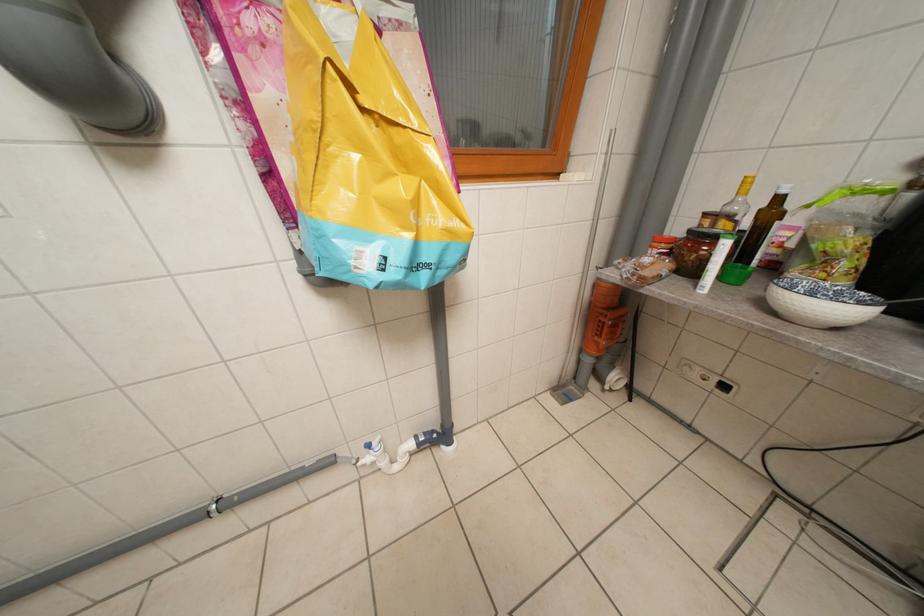
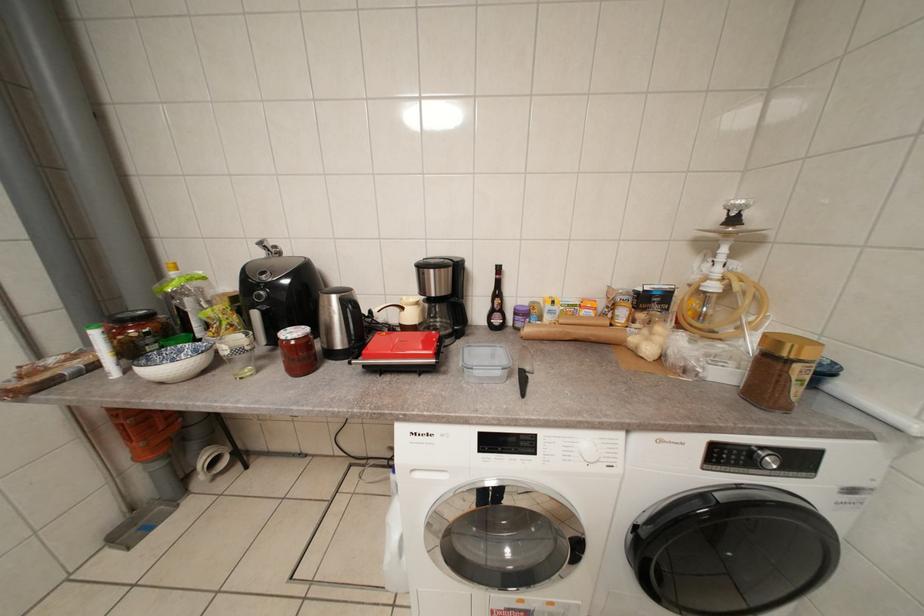
Question: Based on the continuous images, in which direction is the camera rotating? Reply with the corresponding letter.

Choices:
 (A) Left
 (B) Right
 (C) Up
 (D) Down

Answer: (B)